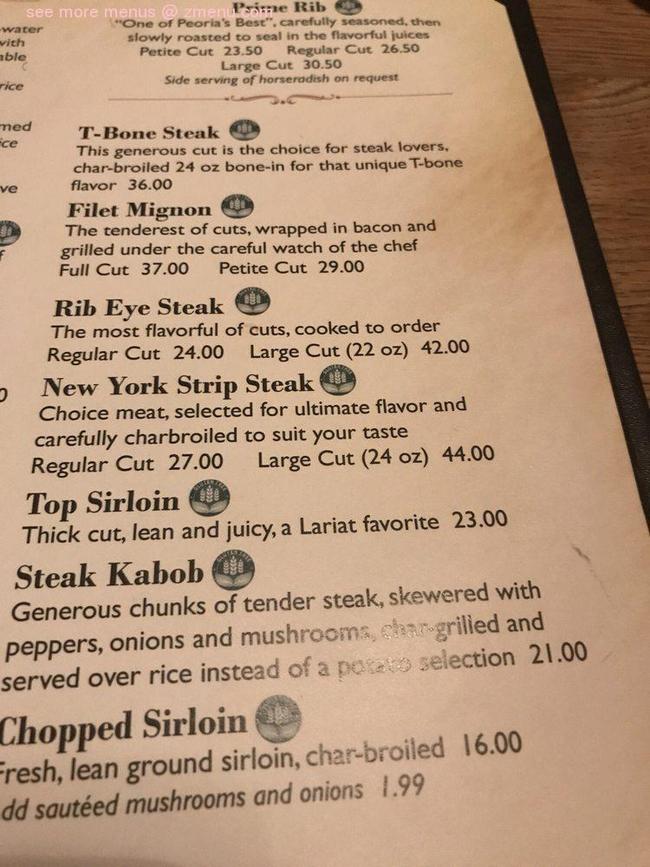
The height and width of the screenshot is (867, 650). I want to click on decorative trim, so click(286, 101).